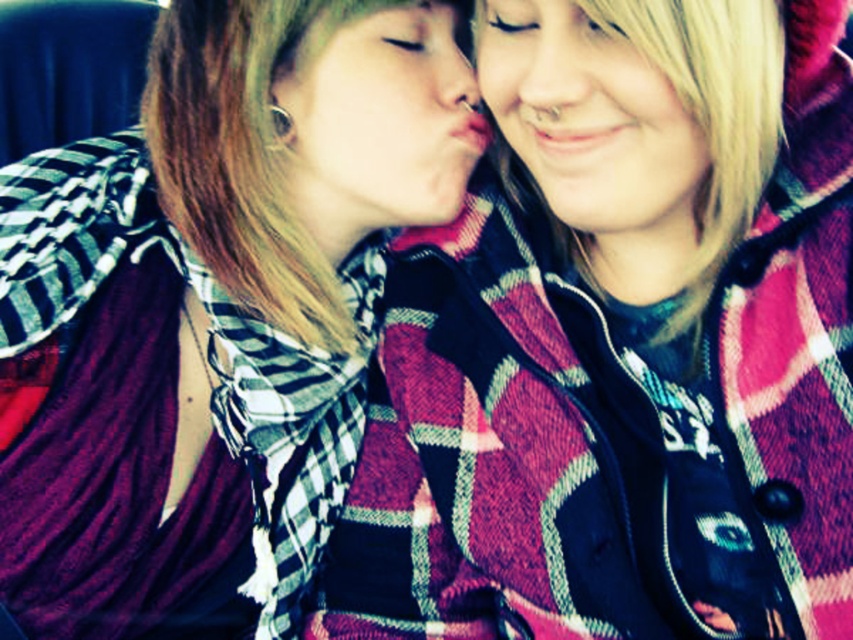
Question: Among these objects, which one is farthest from the camera?

Choices:
 (A) blonde hair at upper right
 (B) plaid fabric jacket at center
 (C) matte plaid shirt at center
 (D) plaid fabric shirt at center

Answer: (C)

Question: Which object is farther from the camera taking this photo?

Choices:
 (A) matte plaid shirt at center
 (B) blonde hair at upper right

Answer: (A)

Question: Where is plaid fabric shirt at center located in relation to plaid fabric jacket at center in the image?

Choices:
 (A) above
 (B) below

Answer: (A)

Question: Is plaid fabric shirt at center to the left of blonde hair at upper right from the viewer's perspective?

Choices:
 (A) no
 (B) yes

Answer: (B)

Question: Which object is positioned farthest from the blonde hair at upper right?

Choices:
 (A) plaid fabric shirt at center
 (B) matte plaid shirt at center

Answer: (A)

Question: Can you confirm if blonde hair at upper right is thinner than matte plaid shirt at center?

Choices:
 (A) yes
 (B) no

Answer: (A)